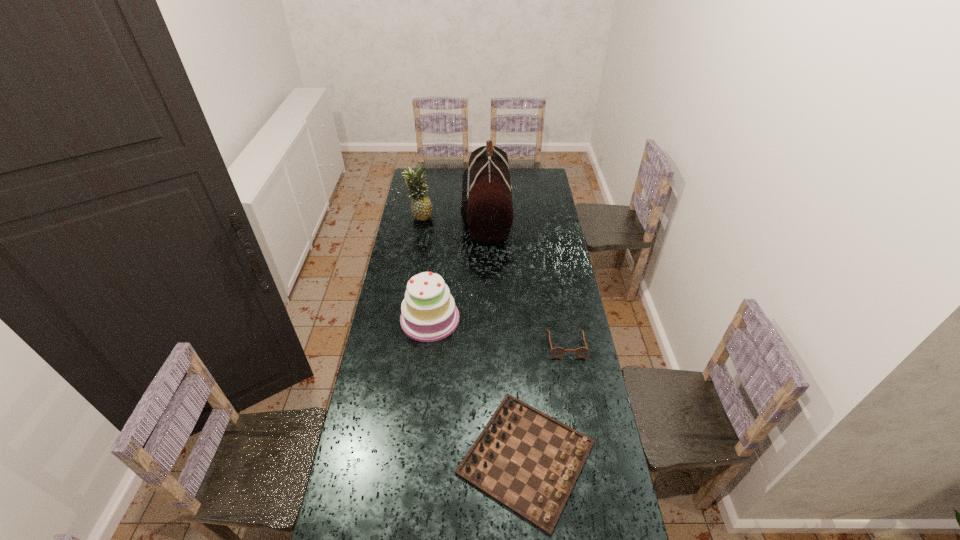
I want to click on free location located on the right of the third shortest object, so click(542, 319).

I want to click on vacant area situated on the back of the nearest object, so click(x=516, y=329).

Find the location of `vacant position located on the front-facing side of the spectacles`. vacant position located on the front-facing side of the spectacles is located at coordinates (579, 413).

This screenshot has width=960, height=540. In order to click on object that is at the far edge in this screenshot , I will do 486,207.

Find the location of a particular element. This screenshot has height=540, width=960. pineapple at the left edge is located at coordinates (421, 207).

Locate an element on the screen. Image resolution: width=960 pixels, height=540 pixels. cake at the left edge is located at coordinates (428, 313).

At what (x,y) coordinates should I click in order to perform the action: click on chessboard that is at the right edge. Please return your answer as a coordinate pair (x, y). Looking at the image, I should click on (528, 461).

The width and height of the screenshot is (960, 540). In order to click on spectacles positioned at the right edge in this screenshot , I will do pyautogui.click(x=557, y=352).

In the image, there is a desktop. Identify the location of vacant space at the far edge. (448, 176).

Identify the location of free space at the left edge of the desktop. The image size is (960, 540). (367, 436).